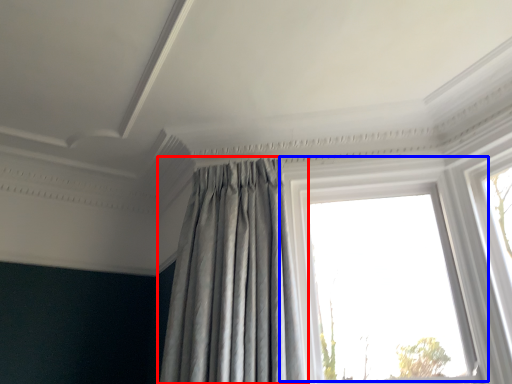
Question: Which of the following is the closest to the observer, curtain (highlighted by a red box) or window (highlighted by a blue box)?

Choices:
 (A) curtain
 (B) window

Answer: (A)